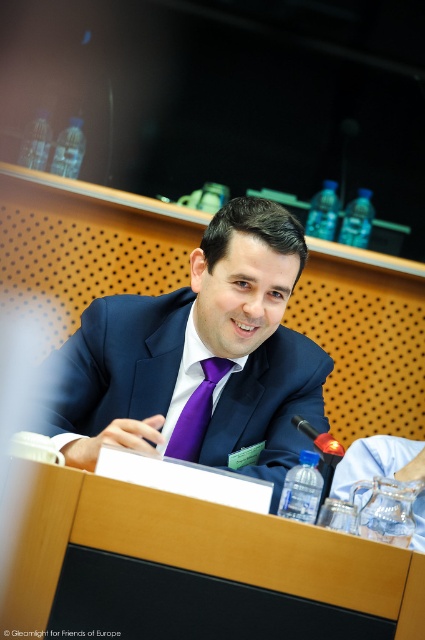
Question: Does matte black suit at center have a larger size compared to clear glass water at lower right?

Choices:
 (A) no
 (B) yes

Answer: (B)

Question: Estimate the real-world distances between objects in this image. Which object is farther from the clear glass water at lower right?

Choices:
 (A) wooden table at center
 (B) matte black suit at center

Answer: (A)

Question: Which point is farther to the camera?

Choices:
 (A) clear glass water at lower right
 (B) matte black suit at center
 (C) purple satin tie at center
 (D) wooden table at center

Answer: (C)

Question: Which point is farther from the camera taking this photo?

Choices:
 (A) (252, 324)
 (B) (192, 410)

Answer: (B)

Question: Can you confirm if wooden table at center is positioned below matte black suit at center?

Choices:
 (A) yes
 (B) no

Answer: (A)

Question: Is wooden table at center above matte black suit at center?

Choices:
 (A) yes
 (B) no

Answer: (B)